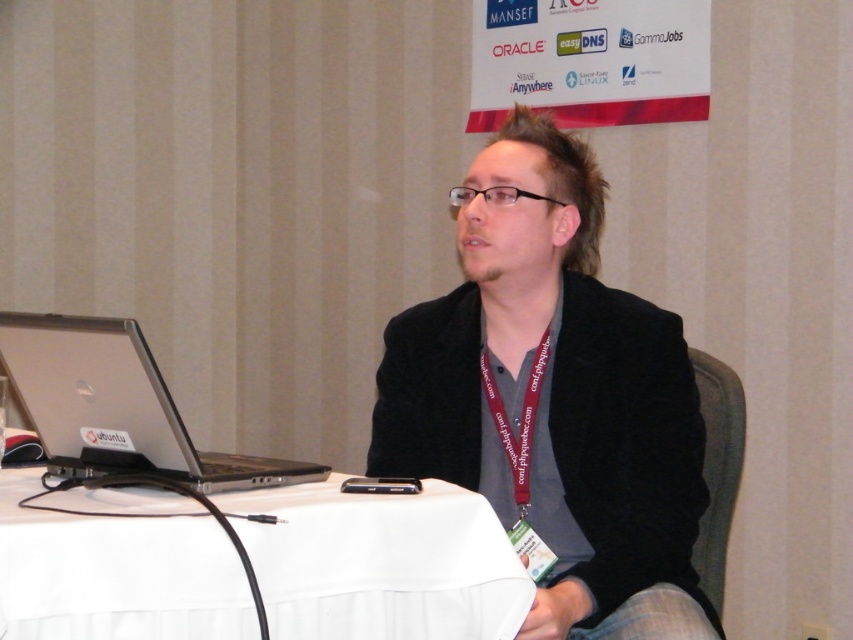
You are organizing a conference and need to ensure that all participants have enough space for their devices. Given the white fabric table at lower left and the skinny neck at center, which object can accommodate a larger item?

The white fabric table at lower left is larger in size than the skinny neck at center, so it can accommodate a larger item.

You are taking a photo of the conference table setup. You need to focus on either the point at coordinates point (125, 403) or point (741, 408). Which point should you focus on to ensure it appears clearer in the photo?

You should focus on point (125, 403) because it is closer to the camera than point (741, 408), so it will appear clearer in the photo.